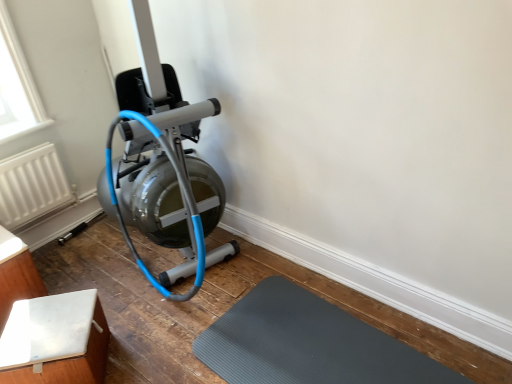
Identify the location of unoccupied space behind white matte table at lower left, the 1th furniture when ordered from right to left. (124, 306).